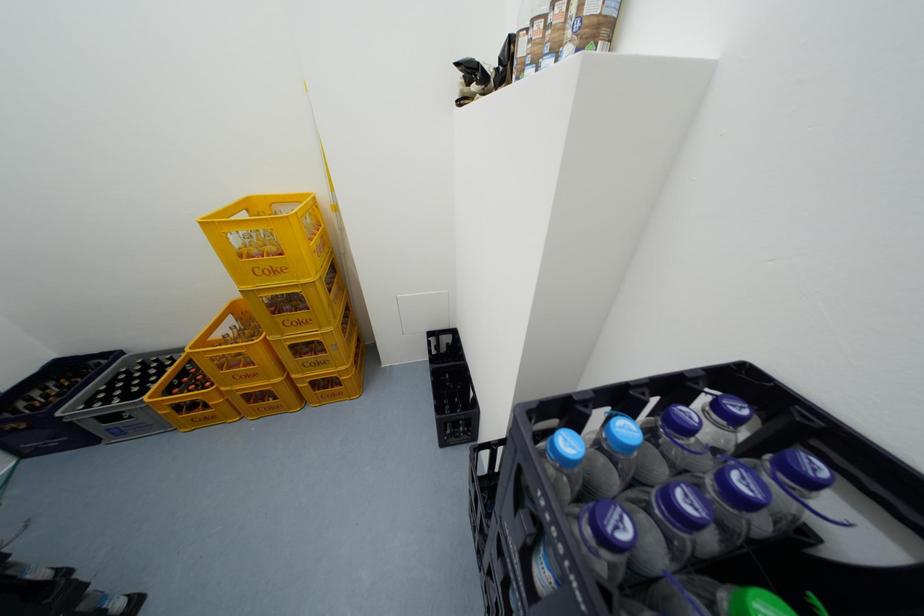
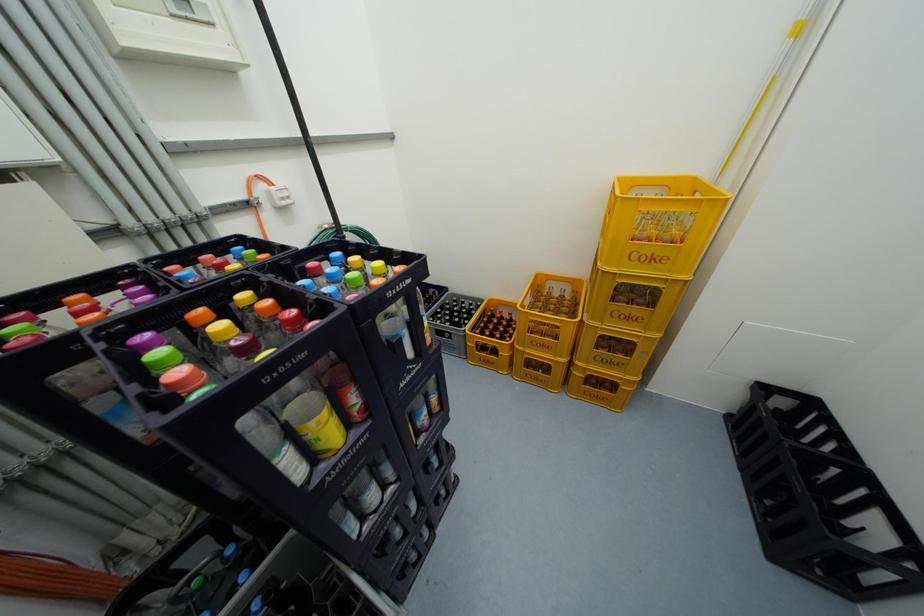
Question: The first image is from the beginning of the video and the second image is from the end. How did the camera likely rotate when shooting the video?

Choices:
 (A) Left
 (B) Right
 (C) Up
 (D) Down

Answer: (A)